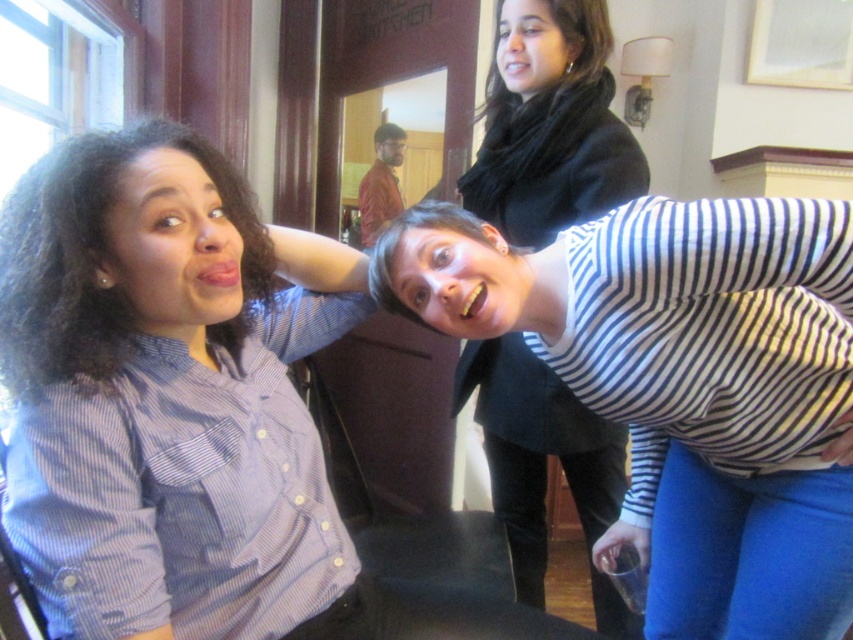
You are a photographer trying to capture the perfect shot of the black silky scarf at upper center. The camera you are using has a fixed focus point at coordinate point [582,38]. Will the scarf be in focus?

The black silky scarf at upper center is located at point [582,38], so yes, the scarf will be in focus since the camera focus point is exactly at that coordinate.

You are a photographer trying to capture a candid shot of the scene. You notice the white striped shirt at lower right and the black silky scarf at upper center. Which object would require you to zoom out more to ensure both are fully visible in the frame?

The white striped shirt at lower right has a larger size compared to the black silky scarf at upper center, so you would need to zoom out more to include the larger white striped shirt at lower right in the frame.

You are a photographer trying to capture a candid shot of the striped fabric shirt at upper right and the red shirt at center. Based on their positions, which one would you need to focus on first if you want to ensure both are in sharp focus?

The striped fabric shirt at upper right is located below the red shirt at center. Since the red shirt at center is closer to the camera, you should focus on the red shirt at center first to ensure both are in focus.